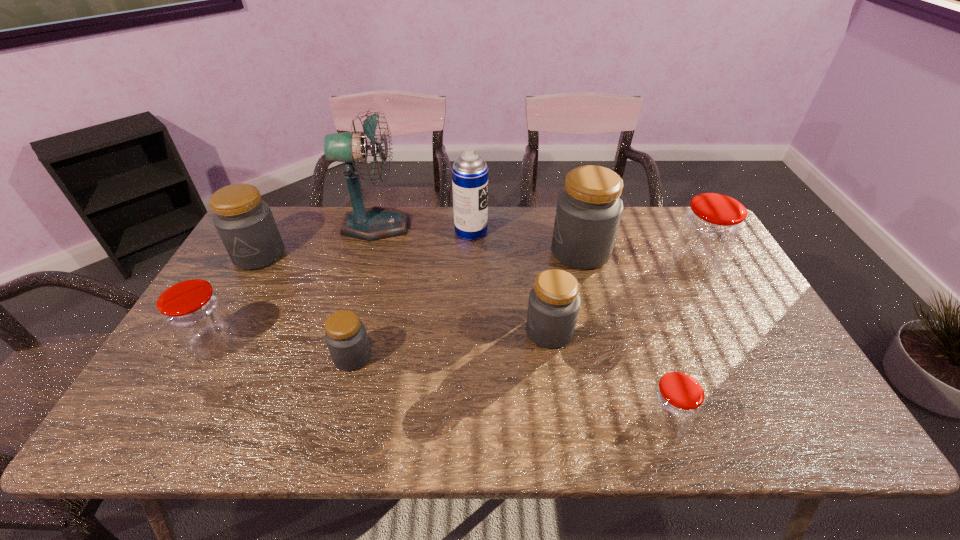
I want to click on free space that satisfies the following two spatial constraints: 1. on the surface of the biggest gray jar near the warning symbol; 2. on the front side of the second smallest red jar, so click(604, 344).

Identify the location of vacant region that satisfies the following two spatial constraints: 1. on the label side of the second red jar from left to right; 2. on the right side of the fifth object from left to right. (467, 423).

You are a GUI agent. You are given a task and a screenshot of the screen. Output one action in this format:
    pyautogui.click(x=<x>, y=<y>)
    Task: Click on the free point that satisfies the following two spatial constraints: 1. on the surface of the second smallest gray jar near the warning symbol; 2. on the back side of the second red jar from left to right
    
    Given the screenshot: What is the action you would take?
    coord(563,423)

Find the location of a particular element. vacant position in the image that satisfies the following two spatial constraints: 1. on the surface of the nearest object near the warning symbol; 2. on the left side of the leftmost gray jar is located at coordinates (164, 423).

Locate an element on the screen. free location that satisfies the following two spatial constraints: 1. on the surface of the third biggest gray jar near the warning symbol; 2. on the front side of the leftmost red jar is located at coordinates (551, 344).